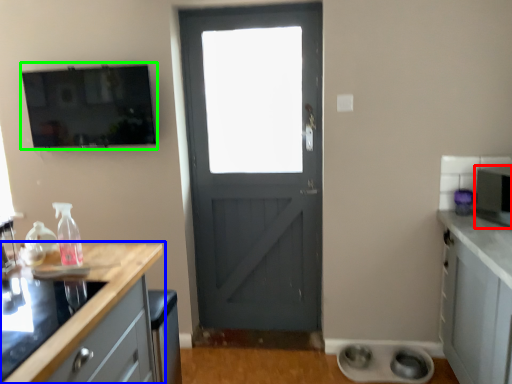
Question: Based on their relative distances, which object is nearer to appliance (highlighted by a red box)? Choose from countertop (highlighted by a blue box) and window screen (highlighted by a green box).

Choices:
 (A) countertop
 (B) window screen

Answer: (A)